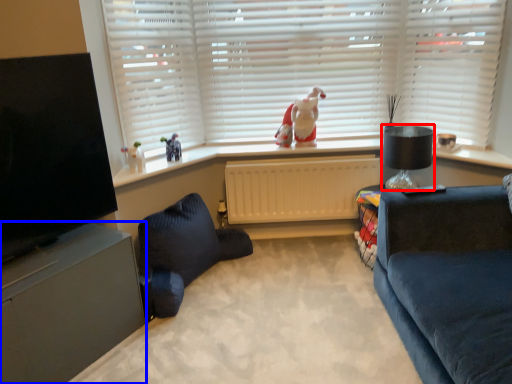
Question: Among these objects, which one is farthest to the camera, lamp (highlighted by a red box) or entertainment center (highlighted by a blue box)?

Choices:
 (A) lamp
 (B) entertainment center

Answer: (A)